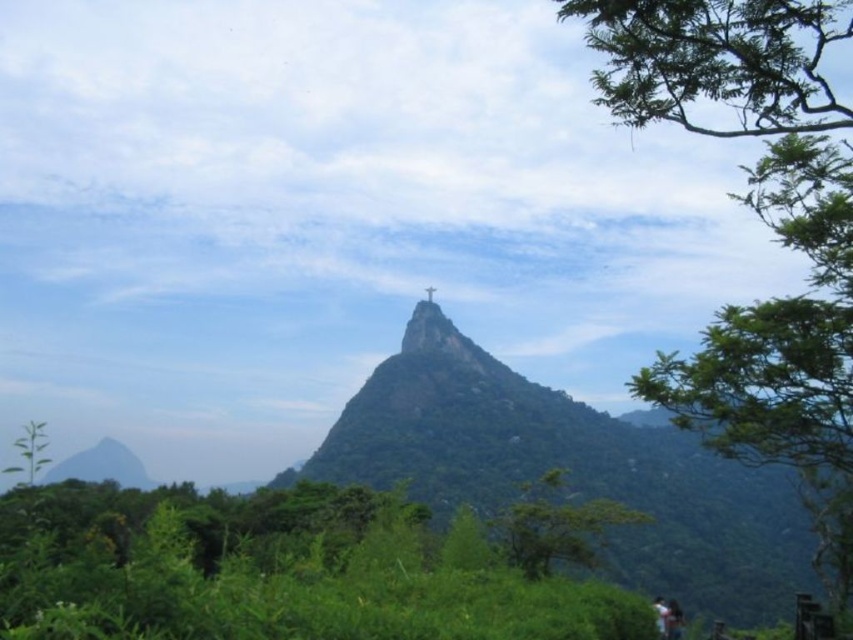
You are a drone operator tasked with capturing aerial footage of the metallic statue at center. The drone must maintain a minimum altitude of 100 meters above the statue to avoid disturbing the environment. Given the statue is at coordinates point 0.523, 0.512, can you confirm if the drone is positioned correctly to capture the statue without violating the altitude restriction?

The metallic statue at center is located at point (436, 333). Since the drone must maintain a minimum altitude of 100 meters above the statue, the operator needs to ensure the drone is at least 100 meters above those coordinates to comply with the restriction. The current position isn not specified, so the operator must verify the altitude relative to the statue.

You are standing at the viewpoint looking at the mountain with the statue. There are two points marked on the image. The first point is at coordinate point (x=807, y=566) and the second is at point (x=671, y=600). Which point is closer to you?

Point (x=671, y=600) is closer to you because it is in front of point (x=807, y=566).